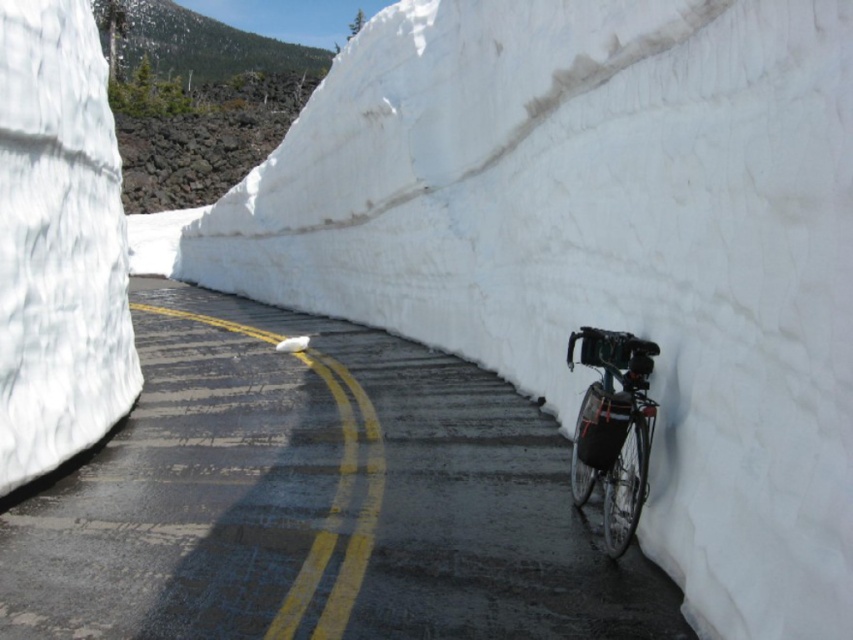
Question: Where is black asphalt road at center located in relation to shiny metallic bicycle at right in the image?

Choices:
 (A) right
 (B) left

Answer: (B)

Question: Can you confirm if black asphalt road at center is thinner than shiny metallic bicycle at right?

Choices:
 (A) no
 (B) yes

Answer: (A)

Question: Which point is closer to the camera?

Choices:
 (A) shiny metallic bicycle at right
 (B) black asphalt road at center

Answer: (B)

Question: Does black asphalt road at center have a larger size compared to shiny metallic bicycle at right?

Choices:
 (A) no
 (B) yes

Answer: (B)